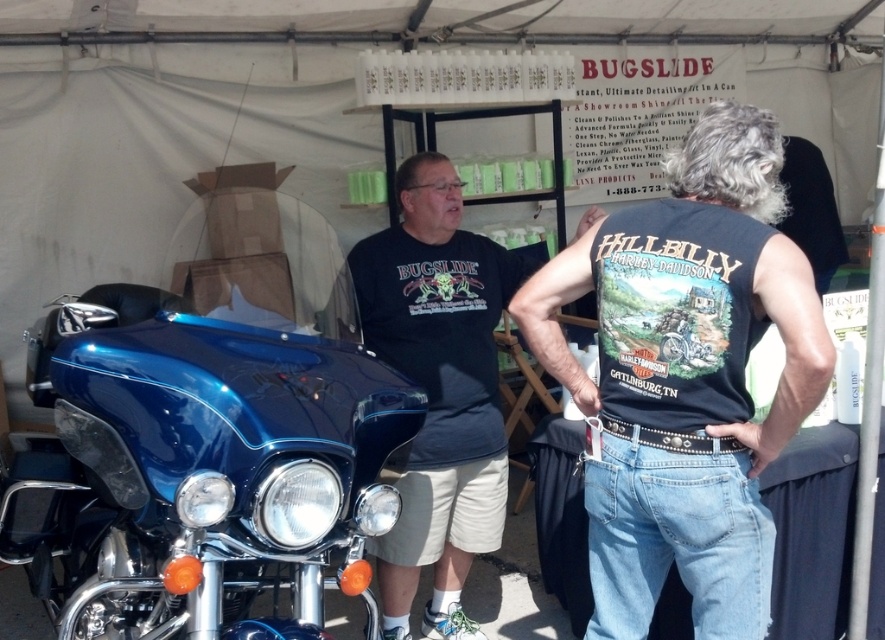
Image resolution: width=885 pixels, height=640 pixels. What are the coordinates of `denim jeans at center` in the screenshot? It's located at (x=686, y=378).

Can you confirm if denim jeans at center is positioned above matte black t-shirt at center?

Yes, denim jeans at center is above matte black t-shirt at center.

What do you see at coordinates (686, 378) in the screenshot? This screenshot has height=640, width=885. I see `denim jeans at center` at bounding box center [686, 378].

At what (x,y) coordinates should I click in order to perform the action: click on denim jeans at center. Please return your answer as a coordinate pair (x, y). This screenshot has width=885, height=640. Looking at the image, I should click on (686, 378).

Consider the image. Who is higher up, glossy blue motorcycle at left or denim jeans at center?

denim jeans at center

Which is in front, point (286, 454) or point (709, 198)?

Positioned in front is point (286, 454).

The image size is (885, 640). Identify the location of glossy blue motorcycle at left. (198, 468).

Can you confirm if glossy blue motorcycle at left is positioned below matte black t-shirt at center?

Yes, glossy blue motorcycle at left is below matte black t-shirt at center.

Does glossy blue motorcycle at left have a smaller size compared to matte black t-shirt at center?

Actually, glossy blue motorcycle at left might be larger than matte black t-shirt at center.

Does point (291, 588) lie in front of point (464, 464)?

Yes, it is.

The image size is (885, 640). Find the location of `glossy blue motorcycle at left`. glossy blue motorcycle at left is located at coordinates (198, 468).